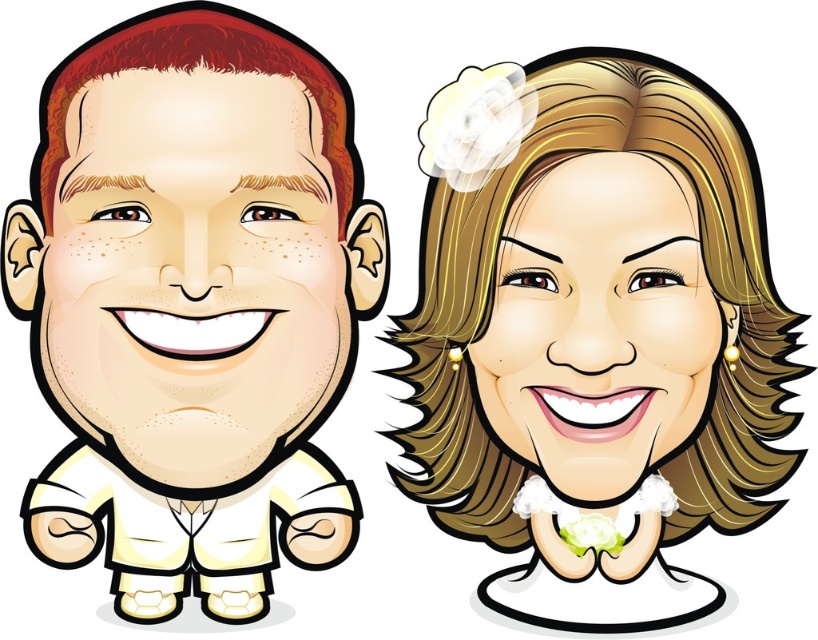
Question: Is matte yellow face at left positioned at the back of smooth blonde hair at center?

Choices:
 (A) no
 (B) yes

Answer: (A)

Question: Which point is farther to the camera?

Choices:
 (A) (789, 428)
 (B) (228, 310)

Answer: (A)

Question: Can you confirm if smooth blonde hair at upper right is wider than matte yellow face at left?

Choices:
 (A) no
 (B) yes

Answer: (B)

Question: Is matte yellow face at left above smooth blonde hair at center?

Choices:
 (A) no
 (B) yes

Answer: (B)

Question: Estimate the real-world distances between objects in this image. Which object is closer to the matte yellow face at left?

Choices:
 (A) smooth blonde hair at center
 (B) smooth blonde hair at upper right

Answer: (B)

Question: Which point appears farthest from the camera in this image?

Choices:
 (A) (551, 346)
 (B) (110, 388)

Answer: (A)